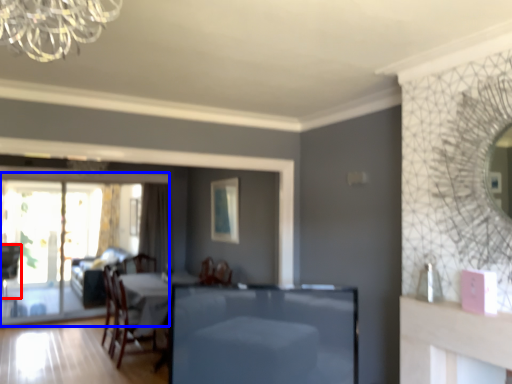
Question: Which object is closer to the camera taking this photo, chair (highlighted by a red box) or screen door (highlighted by a blue box)?

Choices:
 (A) chair
 (B) screen door

Answer: (B)